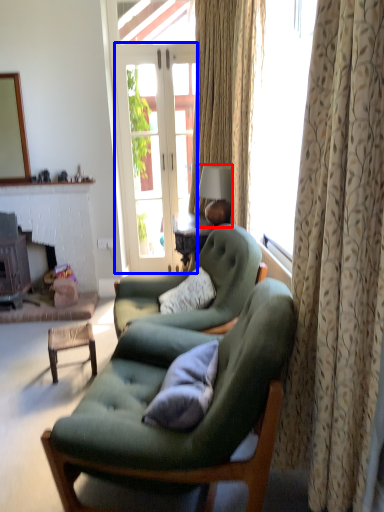
Question: Which of the following is the farthest to the observer, lamp (highlighted by a red box) or screen door (highlighted by a blue box)?

Choices:
 (A) lamp
 (B) screen door

Answer: (B)